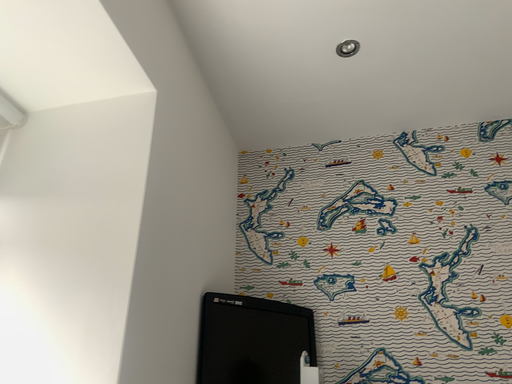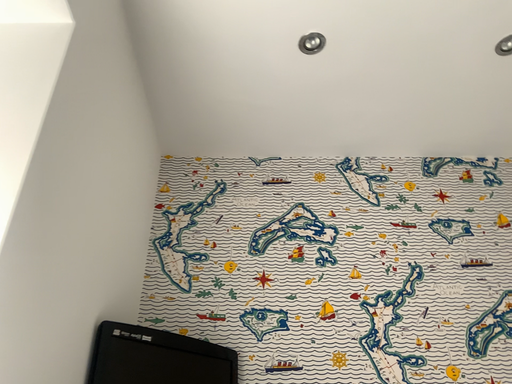
Question: Which way did the camera rotate in the video?

Choices:
 (A) rotated left
 (B) rotated right

Answer: (B)